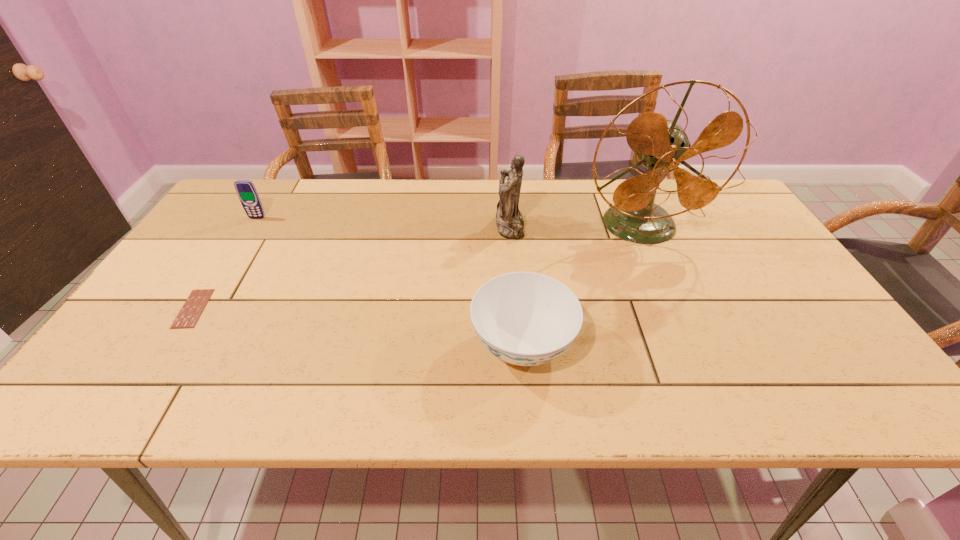
Locate an element on the screen. The image size is (960, 540). the rightmost object is located at coordinates (661, 145).

Where is `fan`? The image size is (960, 540). fan is located at coordinates (661, 145).

I want to click on figurine, so click(x=509, y=220).

Image resolution: width=960 pixels, height=540 pixels. I want to click on cellular telephone, so click(246, 191).

Where is `chinaware`? The image size is (960, 540). chinaware is located at coordinates (524, 318).

The height and width of the screenshot is (540, 960). Identify the location of chocolate bar. (192, 309).

I want to click on vacant position located in front of the fan, directing air flow, so click(x=693, y=345).

At what (x,y) coordinates should I click in order to perform the action: click on vacant region located 0.220m on the front-facing side of the fourth shortest object. Please return your answer as a coordinate pair (x, y). The width and height of the screenshot is (960, 540). Looking at the image, I should click on (421, 226).

Where is `blank space located on the front-facing side of the fourth shortest object`? Image resolution: width=960 pixels, height=540 pixels. blank space located on the front-facing side of the fourth shortest object is located at coordinates (472, 226).

Where is `vacant area situated on the front-facing side of the fourth shortest object`? The height and width of the screenshot is (540, 960). vacant area situated on the front-facing side of the fourth shortest object is located at coordinates (475, 226).